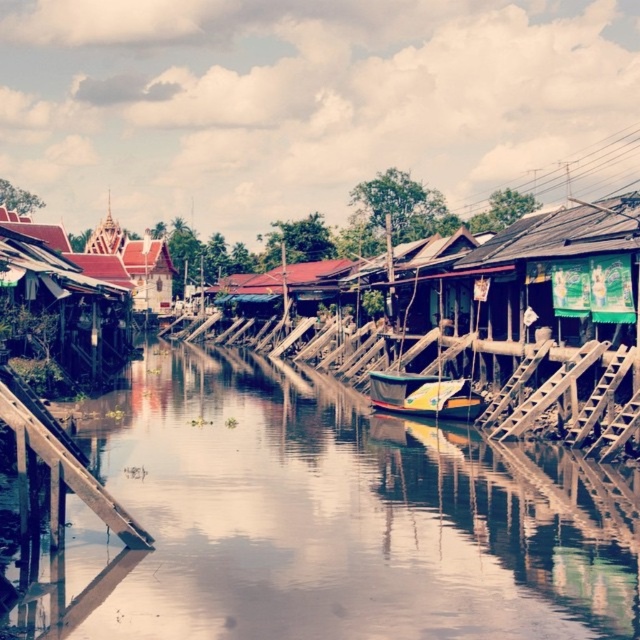
Question: Is brown wooden river at center wider than wooden boat at center?

Choices:
 (A) no
 (B) yes

Answer: (B)

Question: Is brown wooden river at center thinner than wooden boat at center?

Choices:
 (A) no
 (B) yes

Answer: (A)

Question: Can you confirm if brown wooden river at center is positioned below wooden boat at center?

Choices:
 (A) no
 (B) yes

Answer: (B)

Question: Which point is farther from the camera taking this photo?

Choices:
 (A) (394, 396)
 (B) (324, 611)

Answer: (A)

Question: Which of the following is the closest to the observer?

Choices:
 (A) (93, 428)
 (B) (461, 417)

Answer: (A)